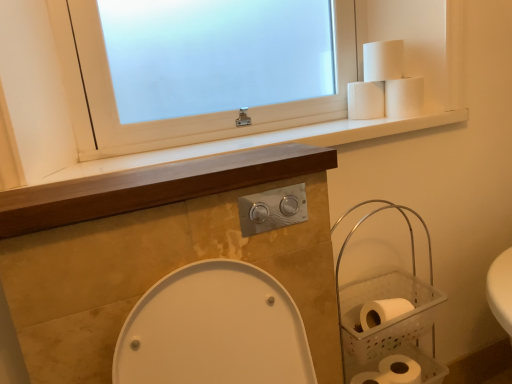
Question: From the image's perspective, is white matte toilet paper at lower right, the 1th toilet paper in the bottom-to-top sequence, over white matte toilet paper at upper right, the 2th toilet paper from the top?

Choices:
 (A) yes
 (B) no

Answer: (B)

Question: Is white matte toilet paper at lower right, the 4th toilet paper positioned from the top, closer to the viewer compared to white matte toilet paper at upper right, the 2th toilet paper from the top?

Choices:
 (A) yes
 (B) no

Answer: (A)

Question: Can you confirm if white matte toilet paper at lower right, the 4th toilet paper positioned from the top, is wider than white matte toilet paper at upper right, which is the third toilet paper from bottom to top?

Choices:
 (A) yes
 (B) no

Answer: (A)

Question: Considering the relative sizes of white matte toilet paper at lower right, the 1th toilet paper in the bottom-to-top sequence, and white matte toilet paper at upper right, the 2th toilet paper from the top, in the image provided, is white matte toilet paper at lower right, the 1th toilet paper in the bottom-to-top sequence, thinner than white matte toilet paper at upper right, the 2th toilet paper from the top,?

Choices:
 (A) yes
 (B) no

Answer: (B)

Question: Would you say white matte toilet paper at lower right, the 1th toilet paper in the bottom-to-top sequence, is outside white matte toilet paper at upper right, the 2th toilet paper from the top?

Choices:
 (A) yes
 (B) no

Answer: (A)

Question: Is white matte toilet paper at lower right, the 1th toilet paper in the bottom-to-top sequence, placed right next to white matte toilet paper at upper right, the 2th toilet paper from the top?

Choices:
 (A) no
 (B) yes

Answer: (A)

Question: Does white frosted glass window at upper center appear on the right side of white matte toilet paper at upper right, which is the third toilet paper in top-to-bottom order?

Choices:
 (A) yes
 (B) no

Answer: (B)

Question: Does white frosted glass window at upper center have a greater height compared to white matte toilet paper at upper right, which is the third toilet paper in top-to-bottom order?

Choices:
 (A) no
 (B) yes

Answer: (B)

Question: Does white frosted glass window at upper center have a smaller size compared to white matte toilet paper at upper right, the 2th toilet paper positioned from the bottom?

Choices:
 (A) no
 (B) yes

Answer: (A)

Question: From the image's perspective, is white frosted glass window at upper center above white matte toilet paper at upper right, the 2th toilet paper positioned from the bottom?

Choices:
 (A) no
 (B) yes

Answer: (B)

Question: Is white frosted glass window at upper center not near white matte toilet paper at upper right, which is the third toilet paper in top-to-bottom order?

Choices:
 (A) yes
 (B) no

Answer: (B)

Question: Does white frosted glass window at upper center have a larger size compared to white matte toilet paper at upper right, which is the third toilet paper in top-to-bottom order?

Choices:
 (A) yes
 (B) no

Answer: (A)

Question: Is white matte toilet paper at upper right, the 2th toilet paper from the top, thinner than white frosted glass window at upper center?

Choices:
 (A) no
 (B) yes

Answer: (A)